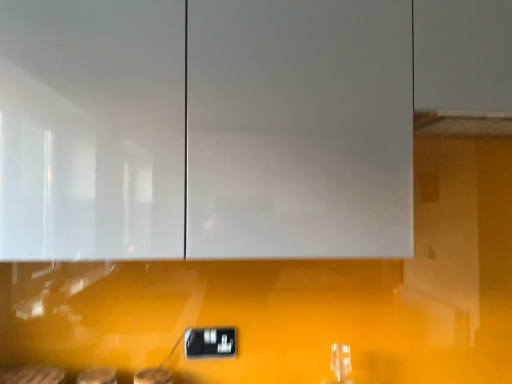
Identify the location of white glossy cabinet at center. Image resolution: width=512 pixels, height=384 pixels. (205, 129).

Measure the distance between white glossy cabinet at center and camera.

The depth of white glossy cabinet at center is 34.43 inches.

The image size is (512, 384). What do you see at coordinates (205, 129) in the screenshot?
I see `white glossy cabinet at center` at bounding box center [205, 129].

At what (x,y) coordinates should I click in order to perform the action: click on white glossy cabinet at center. Please return your answer as a coordinate pair (x, y). Looking at the image, I should click on (205, 129).